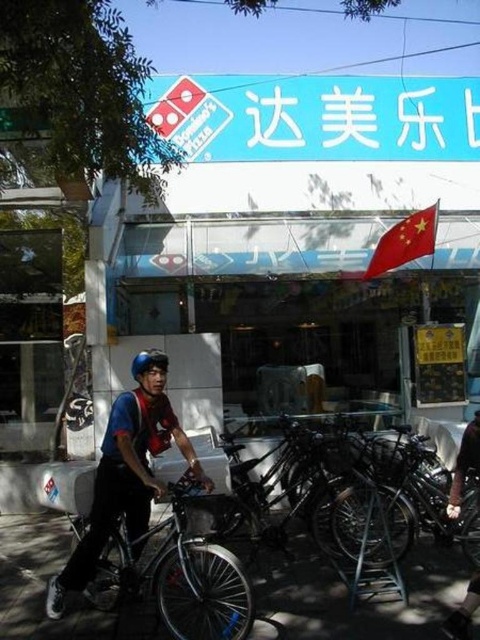
You are a delivery supervisor checking the equipment of your staff. You notice a red helmet at center and a silver metallic bicycle at center. Which equipment has a smaller width?

The red helmet at center is thinner than the silver metallic bicycle at center, so the red helmet at center has a smaller width.

You are a customer waiting for your pizza delivery. You see a shiny metallic bicycle at center and a silver metallic bicycle at center. Which bicycle is closer to you?

The shiny metallic bicycle at center is closer to you because it is further to the viewer than the silver metallic bicycle at center.